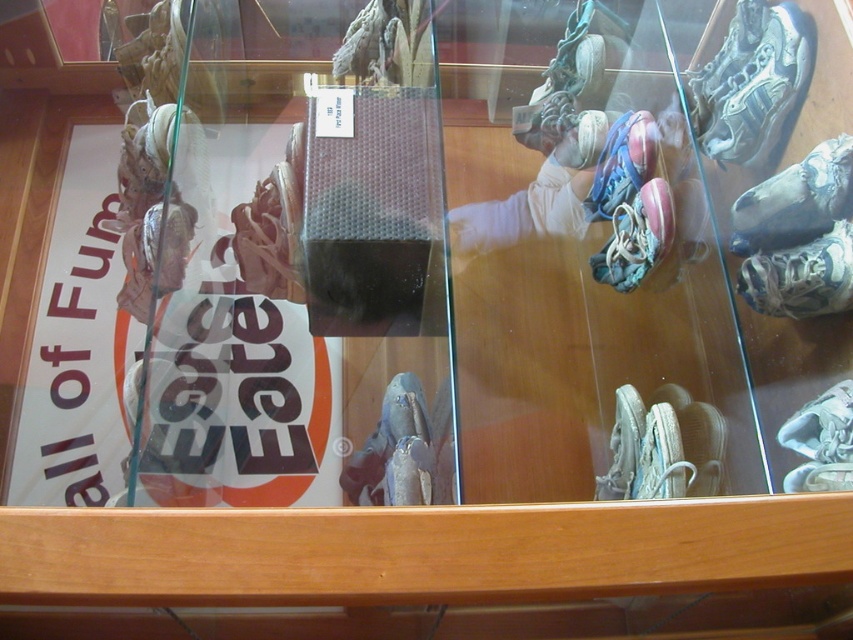
You are a museum curator standing in front of the display case. You need to place a new label on the white paper at left. What are the coordinates where you should place it?

The coordinates for placing the new label on the white paper at left are at point (239,362).

You are a museum curator checking the display case. You need to place a new rectangular label that is 15 cm wide. The white paper at left and the blue suede sneaker at center are already in the case. Which object can the new label fit next to without overlapping?

The new label can fit next to the white paper at left because its width is larger than the blue suede sneaker at center, providing enough space for the 15 cm wide label.

You are a museum curator checking the display case. You notice the white paper at left and the blue suede sneaker at center. Which object is taller?

The white paper at left is taller than the blue suede sneaker at center.